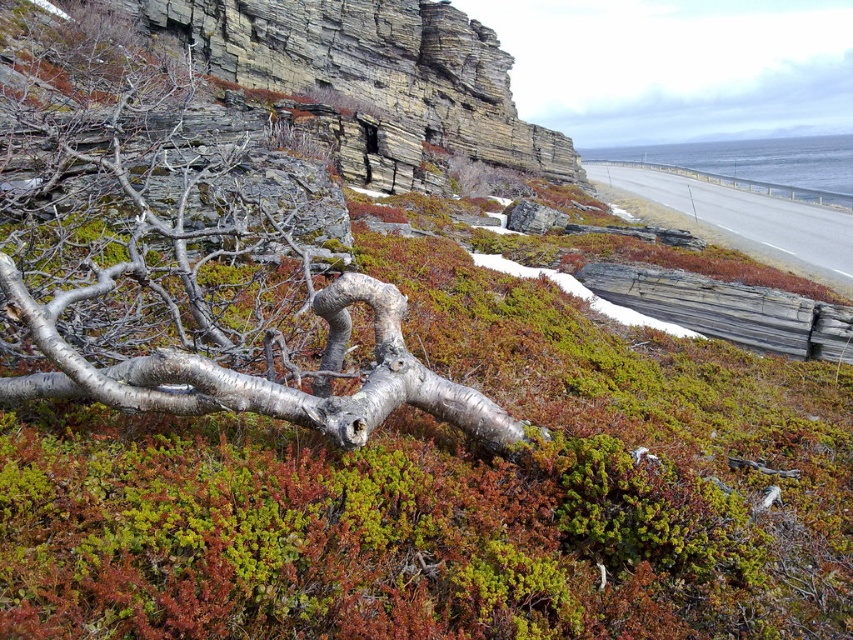
Can you confirm if silver metallic branch at center is taller than asphalt road at upper right?

In fact, silver metallic branch at center may be shorter than asphalt road at upper right.

This screenshot has width=853, height=640. Describe the element at coordinates (192, 273) in the screenshot. I see `silver metallic branch at center` at that location.

Is point (259, 401) closer to camera compared to point (814, 268)?

Yes, point (259, 401) is closer to viewer.

Identify the location of silver metallic branch at center. (192, 273).

Is point (257, 608) closer to camera compared to point (825, 234)?

Yes, point (257, 608) is in front of point (825, 234).

Who is more distant from viewer, (775, 564) or (778, 241)?

Point (778, 241)

At what (x,y) coordinates should I click in order to perform the action: click on green mossy shrubs at center. Please return your answer as a coordinate pair (x, y). The image size is (853, 640). Looking at the image, I should click on (451, 493).

Is point (418, 308) less distant than point (263, 243)?

Yes, point (418, 308) is closer to viewer.

Can you confirm if green mossy shrubs at center is positioned above silver metallic branch at center?

No, green mossy shrubs at center is not above silver metallic branch at center.

Does point (457, 612) come behind point (218, 168)?

That is False.

Locate an element on the screen. The width and height of the screenshot is (853, 640). green mossy shrubs at center is located at coordinates (451, 493).